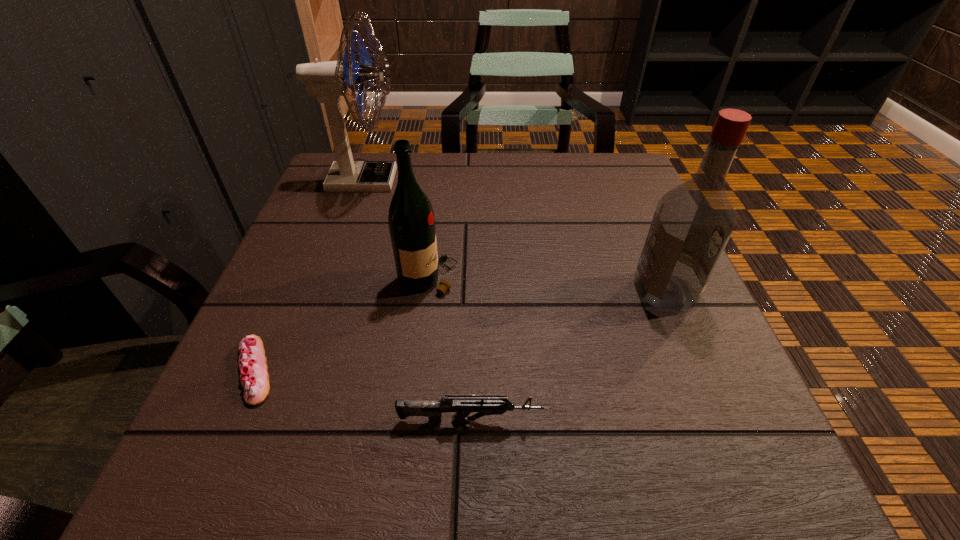
The height and width of the screenshot is (540, 960). I want to click on vacant area situated on the front-facing side of the rightmost object, so click(x=420, y=292).

At what (x,y) coordinates should I click in order to perform the action: click on free spot located on the surface of the wine bottle. Please return your answer as a coordinate pair (x, y). Looking at the image, I should click on (509, 278).

Find the location of a particular element. free region located aimed along the barrel of the nearest object is located at coordinates (646, 421).

I want to click on vacant region located on the back of the eclair, so click(303, 259).

Identify the location of object positioned at the far edge. (328, 80).

This screenshot has height=540, width=960. What are the coordinates of `fan located in the left edge section of the desktop` in the screenshot? It's located at (328, 80).

Identify the location of eclair that is at the left edge. The height and width of the screenshot is (540, 960). (252, 363).

This screenshot has width=960, height=540. What are the coordinates of `object located in the right edge section of the desktop` in the screenshot? It's located at (693, 222).

What are the coordinates of `object that is at the far left corner` in the screenshot? It's located at (328, 80).

The width and height of the screenshot is (960, 540). In the image, there is a desktop. Identify the location of free space at the far edge. (463, 172).